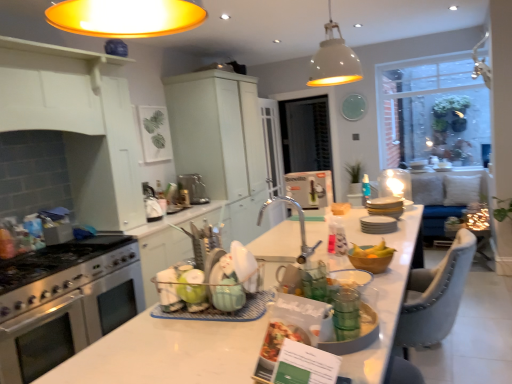
Question: Considering the relative sizes of clear glass window at upper right, the first window screen positioned from the front, and blue plastic spray bottle at center in the image provided, is clear glass window at upper right, the first window screen positioned from the front, shorter than blue plastic spray bottle at center?

Choices:
 (A) yes
 (B) no

Answer: (B)

Question: From the image's perspective, does clear glass window at upper right, arranged as the second window screen when viewed from the left, appear lower than blue plastic spray bottle at center?

Choices:
 (A) no
 (B) yes

Answer: (A)

Question: Is blue plastic spray bottle at center at the back of clear glass window at upper right, the 2th window screen in the back-to-front sequence?

Choices:
 (A) yes
 (B) no

Answer: (B)

Question: Is clear glass window at upper right, the first window screen positioned from the front, to the right of blue plastic spray bottle at center from the viewer's perspective?

Choices:
 (A) yes
 (B) no

Answer: (A)

Question: Is the surface of clear glass window at upper right, which is counted as the first window screen, starting from the right, in direct contact with blue plastic spray bottle at center?

Choices:
 (A) yes
 (B) no

Answer: (B)

Question: From the image's perspective, is blue plastic spray bottle at center positioned above or below matte white cabinet at upper center, the first cabinetry in the back-to-front sequence?

Choices:
 (A) above
 (B) below

Answer: (B)

Question: Is blue plastic spray bottle at center taller or shorter than matte white cabinet at upper center, acting as the 2th cabinetry starting from the left?

Choices:
 (A) tall
 (B) short

Answer: (B)

Question: Considering the relative positions of blue plastic spray bottle at center and matte white cabinet at upper center, the first cabinetry in the back-to-front sequence, in the image provided, is blue plastic spray bottle at center to the left or to the right of matte white cabinet at upper center, the first cabinetry in the back-to-front sequence,?

Choices:
 (A) right
 (B) left

Answer: (A)

Question: Looking at their shapes, would you say blue plastic spray bottle at center is wider or thinner than matte white cabinet at upper center, arranged as the second cabinetry when viewed from the front?

Choices:
 (A) wide
 (B) thin

Answer: (B)

Question: Looking at their shapes, would you say clear glass window at upper right, the 2th window screen in the back-to-front sequence, is wider or thinner than white glossy cabinet at upper left, marked as the first cabinetry in a front-to-back arrangement?

Choices:
 (A) wide
 (B) thin

Answer: (B)

Question: From a real-world perspective, relative to white glossy cabinet at upper left, marked as the first cabinetry in a front-to-back arrangement, is clear glass window at upper right, the first window screen positioned from the front, vertically above or below?

Choices:
 (A) below
 (B) above

Answer: (B)

Question: Is point (393, 114) positioned closer to the camera than point (110, 109)?

Choices:
 (A) closer
 (B) farther

Answer: (B)

Question: Relative to white glossy cabinet at upper left, which is counted as the second cabinetry, starting from the right, is clear glass window at upper right, the 2th window screen in the back-to-front sequence, in front or behind?

Choices:
 (A) front
 (B) behind

Answer: (B)

Question: Based on their positions, is wooden bowl at center located to the left or right of matte white cabinet at upper center, the first cabinetry in the back-to-front sequence?

Choices:
 (A) right
 (B) left

Answer: (A)

Question: In terms of height, does wooden bowl at center look taller or shorter compared to matte white cabinet at upper center, the first cabinetry in the back-to-front sequence?

Choices:
 (A) short
 (B) tall

Answer: (A)